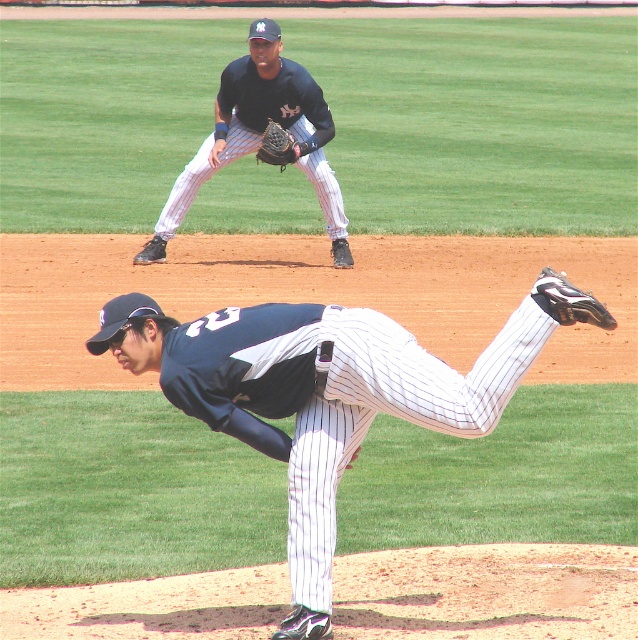
Consider the image. How much distance is there between white pinstriped pants at center and brown leather glove at upper center?

The distance of white pinstriped pants at center from brown leather glove at upper center is 6.95 meters.

Image resolution: width=638 pixels, height=640 pixels. Describe the element at coordinates (327, 394) in the screenshot. I see `white pinstriped pants at center` at that location.

Who is more distant from viewer, (332, 380) or (262, 147)?

Point (262, 147)

In order to click on white pinstriped pants at center in this screenshot , I will do `click(327, 394)`.

Consider the image. Does dark blue jersey at upper center have a lesser width compared to brown leather glove at upper center?

Incorrect, dark blue jersey at upper center's width is not less than brown leather glove at upper center's.

Which of these two, dark blue jersey at upper center or brown leather glove at upper center, stands shorter?

brown leather glove at upper center

In order to click on dark blue jersey at upper center in this screenshot , I will do click(x=260, y=136).

Is point (542, 298) less distant than point (182, 177)?

Yes, point (542, 298) is in front of point (182, 177).

Based on the photo, who is higher up, white pinstriped pants at center or dark blue jersey at upper center?

dark blue jersey at upper center is above.

Identify the location of white pinstriped pants at center. The height and width of the screenshot is (640, 638). (327, 394).